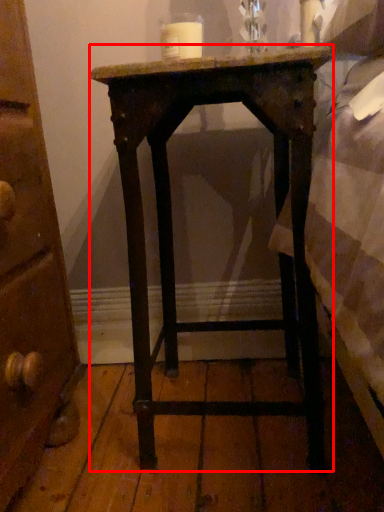
Question: Observing the image, what is the correct spatial positioning of nightstand (annotated by the red box) in reference to candle?

Choices:
 (A) left
 (B) right

Answer: (B)